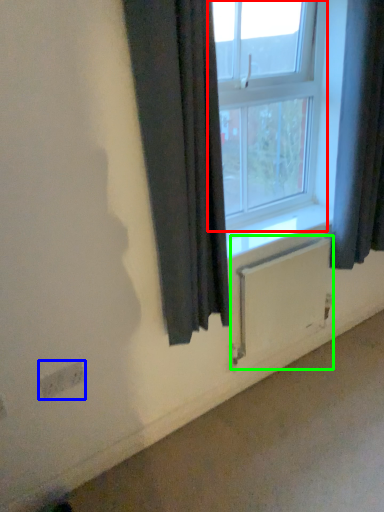
Question: Based on their relative distances, which object is farther from window (highlighted by a red box)? Choose from electric outlet (highlighted by a blue box) and radiator (highlighted by a green box).

Choices:
 (A) electric outlet
 (B) radiator

Answer: (A)